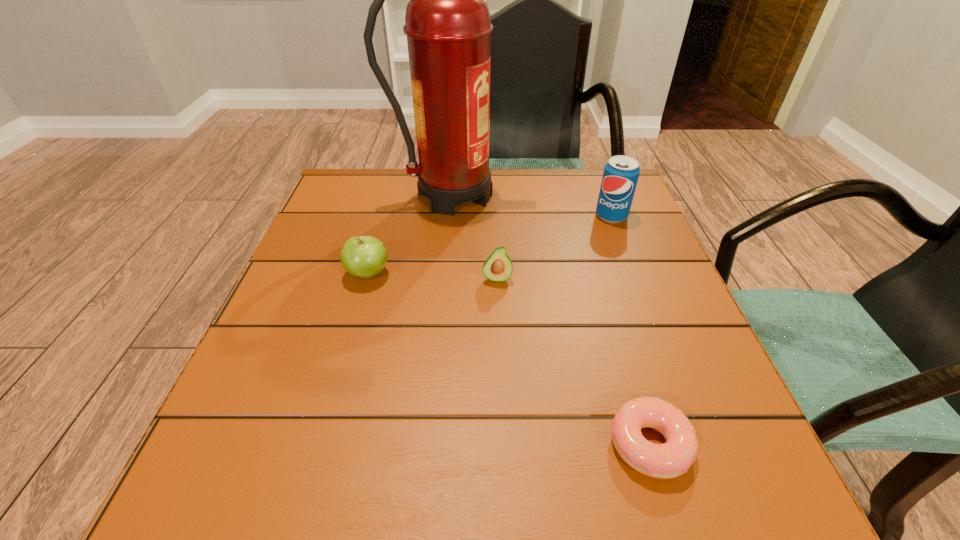
I want to click on fire extinguisher, so click(x=448, y=26).

The height and width of the screenshot is (540, 960). In order to click on soda can in this screenshot , I will do `click(621, 173)`.

This screenshot has height=540, width=960. I want to click on apple, so click(x=364, y=257).

Identify the location of avocado. This screenshot has width=960, height=540. (498, 267).

I want to click on doughnut, so click(671, 459).

Find the location of a particular element. This screenshot has width=960, height=540. the nearest object is located at coordinates (671, 459).

Locate an element on the screen. The width and height of the screenshot is (960, 540). free location located 0.190m on the front-facing side of the fire extinguisher is located at coordinates (588, 195).

Locate an element on the screen. Image resolution: width=960 pixels, height=540 pixels. vacant region located 0.140m on the left of the fourth shortest object is located at coordinates tap(534, 216).

You are a GUI agent. You are given a task and a screenshot of the screen. Output one action in this format:
    pyautogui.click(x=<x>, y=<y>)
    Task: Click on the blank space located 0.220m on the front of the apple
    
    Given the screenshot: What is the action you would take?
    pyautogui.click(x=335, y=390)

Where is `free space located 0.380m on the cut side of the avocado`? The width and height of the screenshot is (960, 540). free space located 0.380m on the cut side of the avocado is located at coordinates (506, 490).